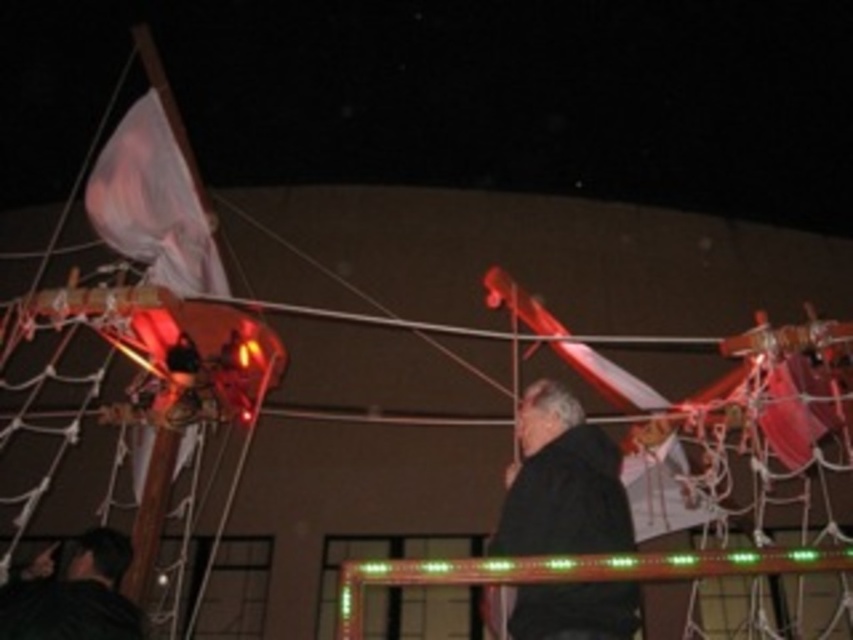
You are a photographer setting up for an event. You need to position a camera 1.5 meters away from the black matte jacket at center. Can you place the camera near the black matte jacket at lower left without exceeding the distance limit?

The distance between the black matte jacket at center and the black matte jacket at lower left is 2.07 meters. Since the camera needs to be placed 1.5 meters away from the black matte jacket at center, placing it near the black matte jacket at lower left would exceed the 1.5 meter limit. Therefore, the camera cannot be placed there.

You are a photographer trying to capture both the black matte jacket at center and the black matte jacket at lower left in a single shot. Which jacket should you focus on first to ensure both are in clear focus?

You should focus on the black matte jacket at center first because it is closer to the viewer than the black matte jacket at lower left, allowing for a greater depth of field to include both in focus.